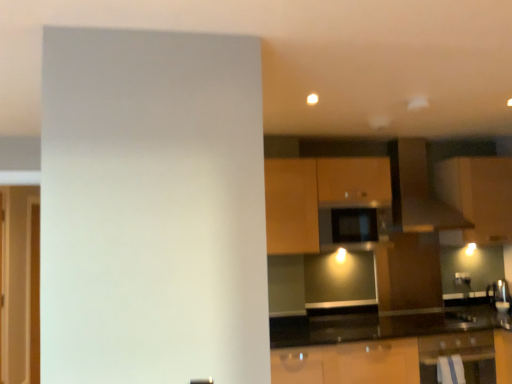
This screenshot has width=512, height=384. In order to click on free space above matte brown exhaust hood at upper center (from a real-world perspective) in this screenshot , I will do `click(412, 130)`.